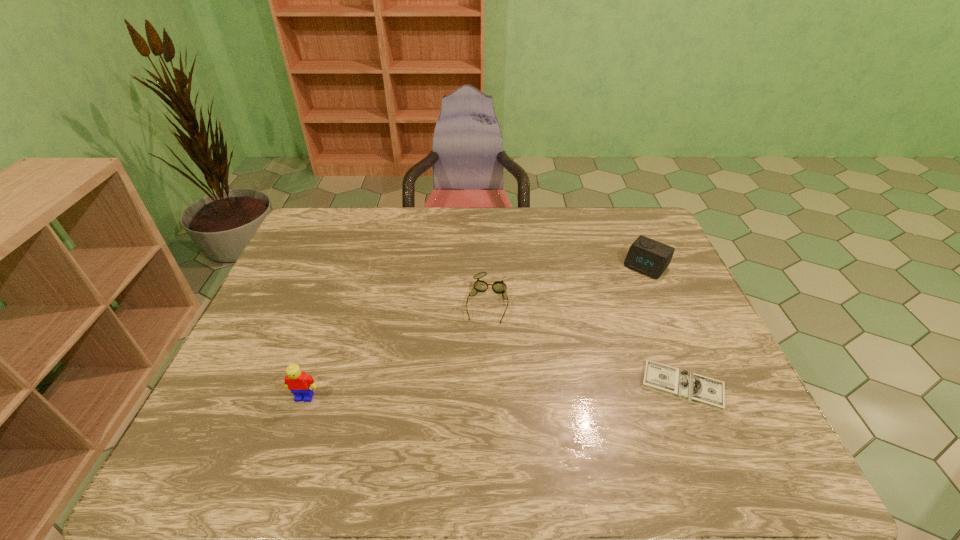
At what (x,y) coordinates should I click in order to perform the action: click on free space on the desktop that is between the leftmost object and the dollar and is positioned on the front-facing side of the spectacles. Please return your answer as a coordinate pair (x, y). Looking at the image, I should click on (471, 392).

Where is `vacant space on the desktop that is between the Lego and the dollar and is positioned on the front-facing side of the third shortest object`? vacant space on the desktop that is between the Lego and the dollar and is positioned on the front-facing side of the third shortest object is located at coordinates (544, 390).